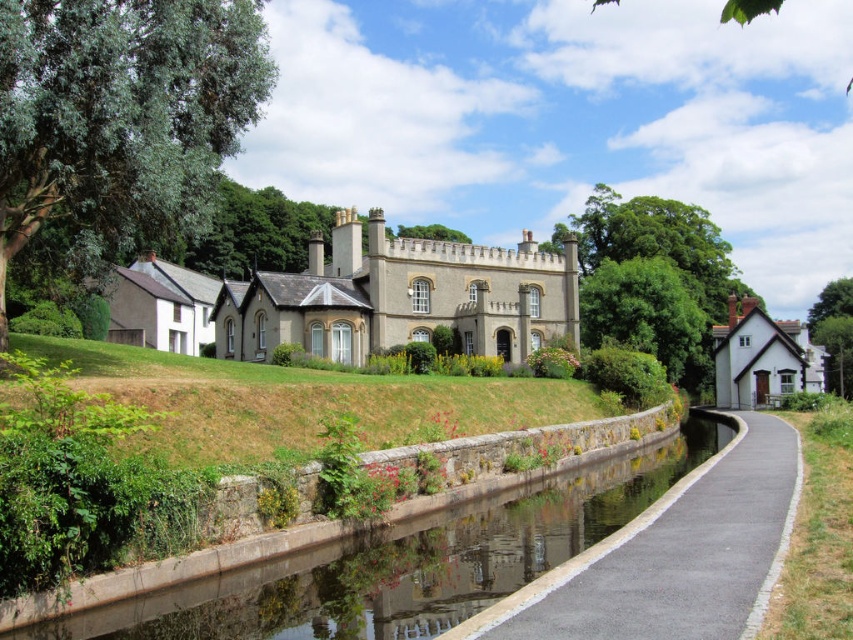
Who is higher up, smooth concrete canal at center or gray stone castle at center?

gray stone castle at center is higher up.

Does smooth concrete canal at center appear on the left side of gray stone castle at center?

In fact, smooth concrete canal at center is to the right of gray stone castle at center.

Is point (387, 632) more distant than point (256, 323)?

No, (387, 632) is in front of (256, 323).

In order to click on smooth concrete canal at center in this screenshot , I will do 408,561.

Is black asphalt path at center to the left of gray stone castle at center from the viewer's perspective?

No, black asphalt path at center is not to the left of gray stone castle at center.

Is black asphalt path at center shorter than gray stone castle at center?

Yes, black asphalt path at center is shorter than gray stone castle at center.

Does point (764, 515) lie in front of point (473, 269)?

Yes, it is in front of point (473, 269).

Locate an element on the screen. Image resolution: width=853 pixels, height=640 pixels. black asphalt path at center is located at coordinates point(675,554).

Can you confirm if smooth concrete canal at center is smaller than black asphalt path at center?

Yes.

What do you see at coordinates (408, 561) in the screenshot? I see `smooth concrete canal at center` at bounding box center [408, 561].

The width and height of the screenshot is (853, 640). Find the location of `smooth concrete canal at center`. smooth concrete canal at center is located at coordinates point(408,561).